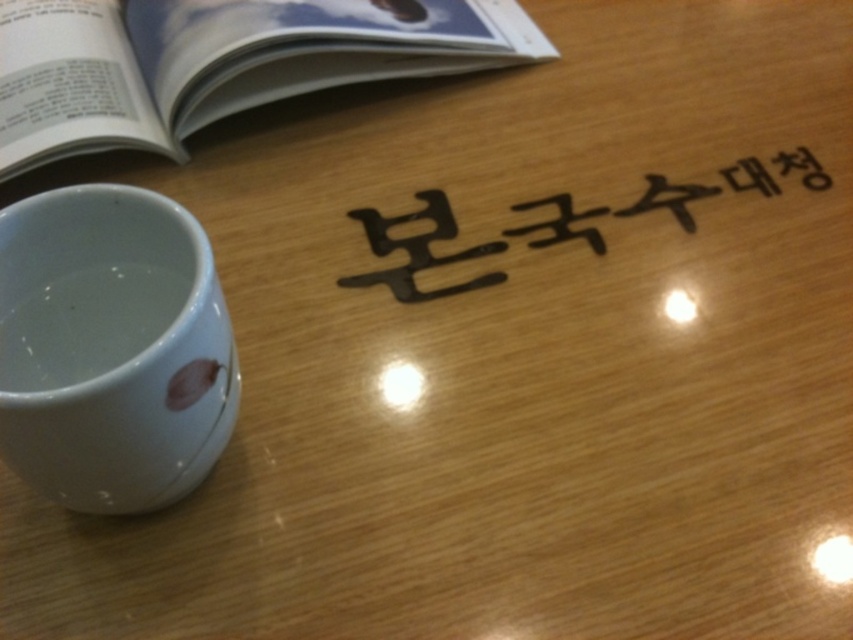
You are standing in front of the wooden table with the text. There are two points marked on the table surface at coordinates point (296,28) and point (670,202). If you want to place a small sticker on the point closer to you, which coordinate should you choose?

Point (296,28) is closer to you than point (670,202), so you should choose point (296,28) to place the sticker.

You are a barista who needs to place a new menu sign on the table. The new sign must be exactly 15 inches away from the white glossy mug at lower left. Is the current black matte sign at center positioned correctly?

The distance between the white glossy mug at lower left and the black matte sign at center is 14.92 inches, which is just 0.08 inches less than the required 15 inches. Therefore, the black matte sign at center is almost but not exactly positioned at the required distance. The barista may need to adjust it slightly further away to meet the 15 inch requirement.

What are the coordinates of the matte paper book at upper left on the table?

The matte paper book at upper left is located at coordinates point [218,61].